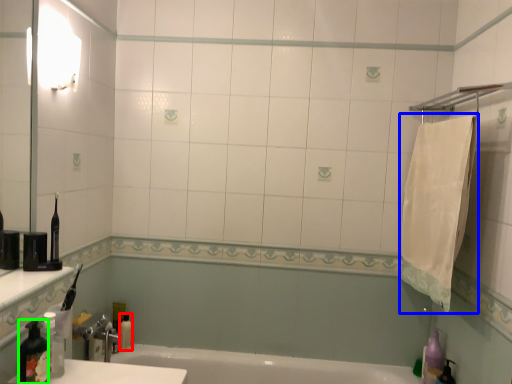
Question: Based on their relative distances, which object is farther from toiletry (highlighted by a red box)? Choose from bath towel (highlighted by a blue box) and bottle (highlighted by a green box).

Choices:
 (A) bath towel
 (B) bottle

Answer: (A)